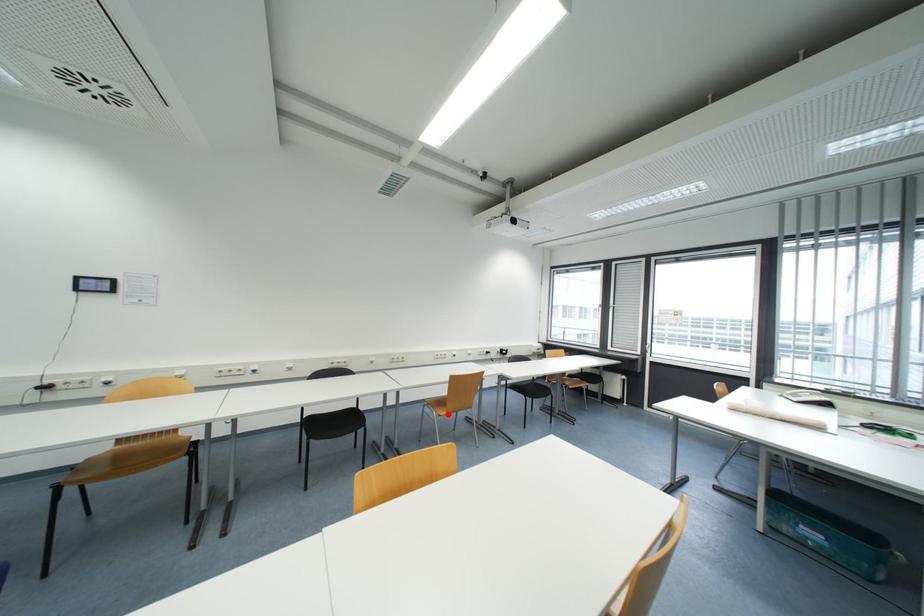
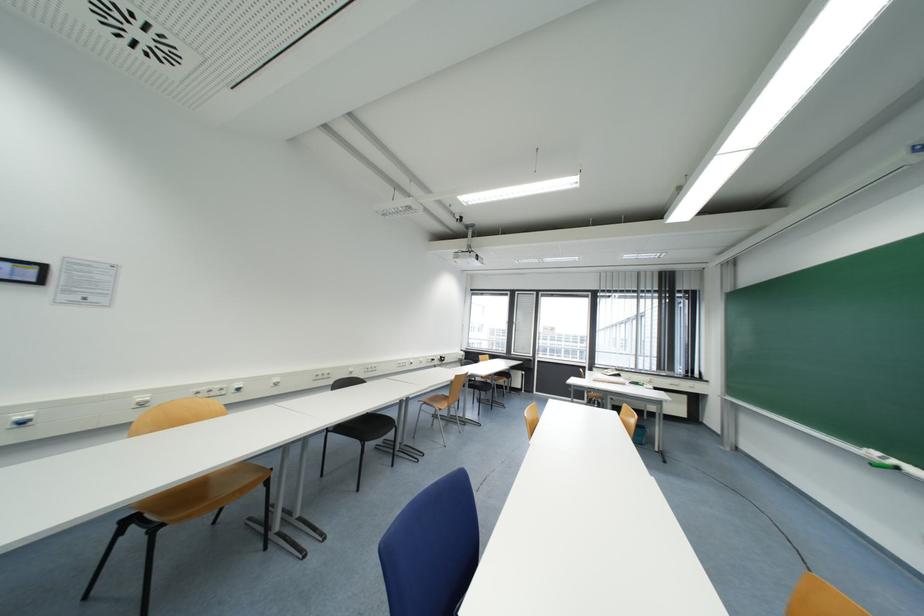
Question: I am providing you with two images of the same scene from different viewpoints. Given a red point in image1, look at the same physical point in image2. Is it:

Choices:
 (A) Closer to the viewpoint
 (B) Farther from the viewpoint

Answer: (A)